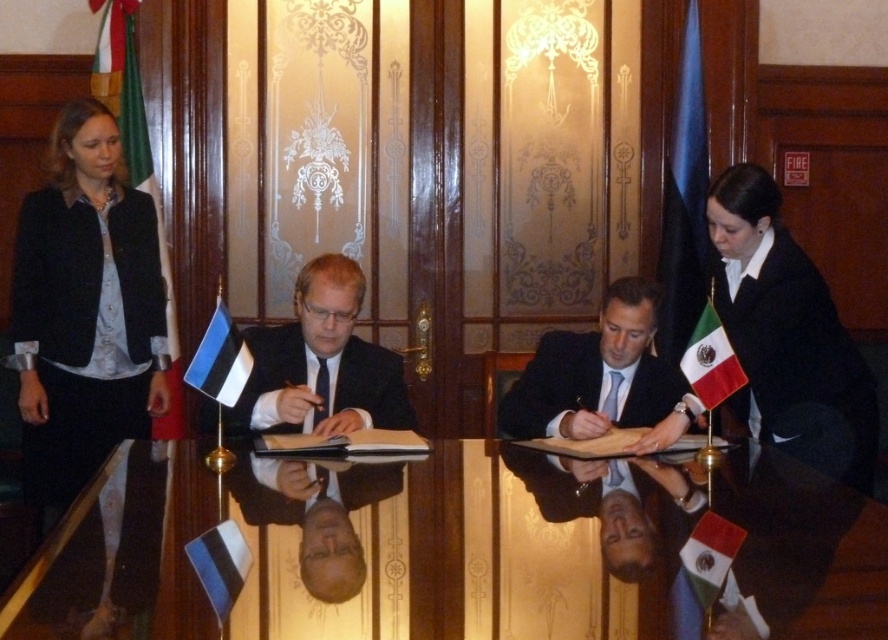
From the picture: Is black glossy table at center taller than red fabric flag at lower right?

Indeed, black glossy table at center has a greater height compared to red fabric flag at lower right.

Is black glossy table at center thinner than red fabric flag at lower right?

In fact, black glossy table at center might be wider than red fabric flag at lower right.

Find the location of a particular element. black glossy table at center is located at coordinates (457, 547).

What are the coordinates of `black glossy table at center` in the screenshot? It's located at (457, 547).

Between point (836, 467) and point (211, 328), which one is positioned behind?

Point (836, 467)

Does black smooth suit at right have a smaller size compared to whiteflag at left?

No, black smooth suit at right is not smaller than whiteflag at left.

Where is `black smooth suit at right`? black smooth suit at right is located at coordinates (797, 360).

Does black matte suit at center have a larger size compared to dark blue suit at center?

Yes, black matte suit at center is bigger than dark blue suit at center.

Is black matte suit at center to the right of dark blue suit at center from the viewer's perspective?

No, black matte suit at center is not to the right of dark blue suit at center.

Does point (379, 365) come farther from viewer compared to point (667, 406)?

No.

Locate an element on the screen. black matte suit at center is located at coordinates (318, 381).